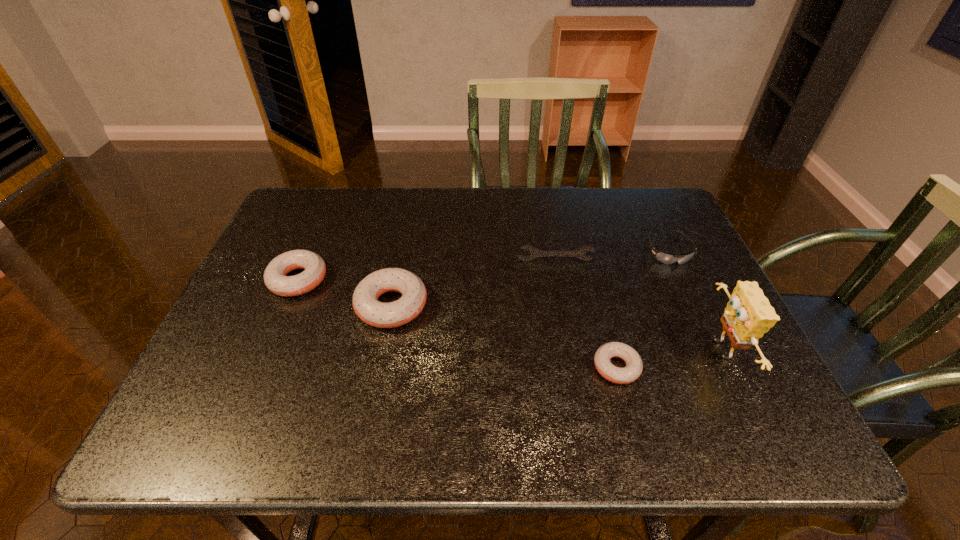
This screenshot has height=540, width=960. What are the coordinates of `free spot between the tallest object and the shortest doughnut` in the screenshot? It's located at (668, 359).

Identify the location of free space between the tallest object and the second doughnut from left to right. (556, 328).

Image resolution: width=960 pixels, height=540 pixels. What are the coordinates of `vacant area between the sunglasses and the leftmost doughnut` in the screenshot? It's located at (483, 266).

The width and height of the screenshot is (960, 540). Find the location of `empty location between the wrench and the sponge`. empty location between the wrench and the sponge is located at coordinates (637, 305).

Identify the location of free point between the shortest doughnut and the tallest object. 668,359.

The image size is (960, 540). I want to click on vacant space that's between the wrench and the second object from left to right, so point(473,283).

What are the coordinates of `empty space between the wrench and the second doughnut from left to right` in the screenshot? It's located at (473, 283).

Image resolution: width=960 pixels, height=540 pixels. In order to click on vacant area that lies between the fifth object from right to left and the sunglasses in this screenshot , I will do (530, 278).

Locate which object ranks in proximity to the wrench. Please provide its 2D coordinates. Your answer should be formatted as a tuple, i.e. [(x, y)], where the tuple contains the x and y coordinates of a point satisfying the conditions above.

[(664, 258)]

At what (x,y) coordinates should I click in order to perform the action: click on object identified as the second closest to the sunglasses. Please return your answer as a coordinate pair (x, y). The width and height of the screenshot is (960, 540). Looking at the image, I should click on (748, 315).